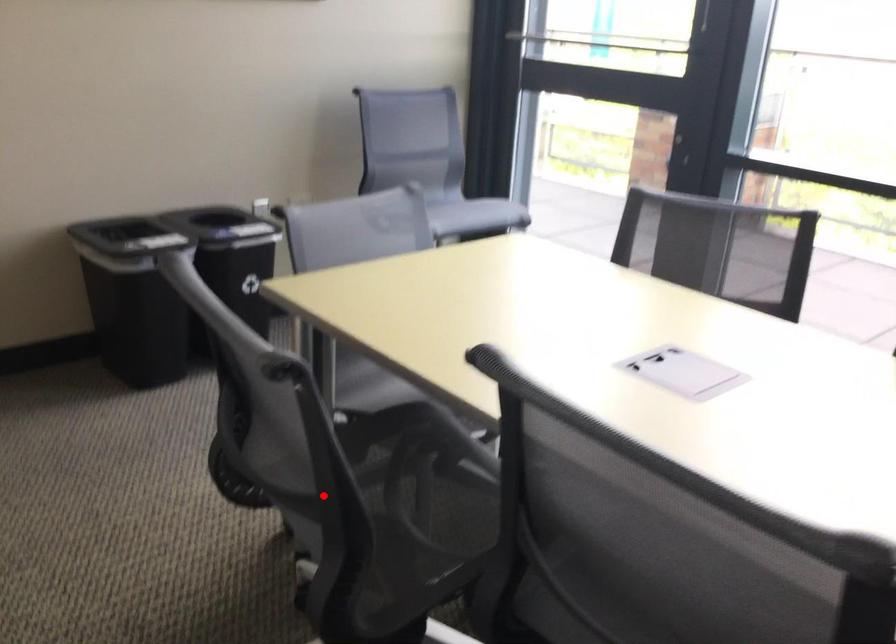
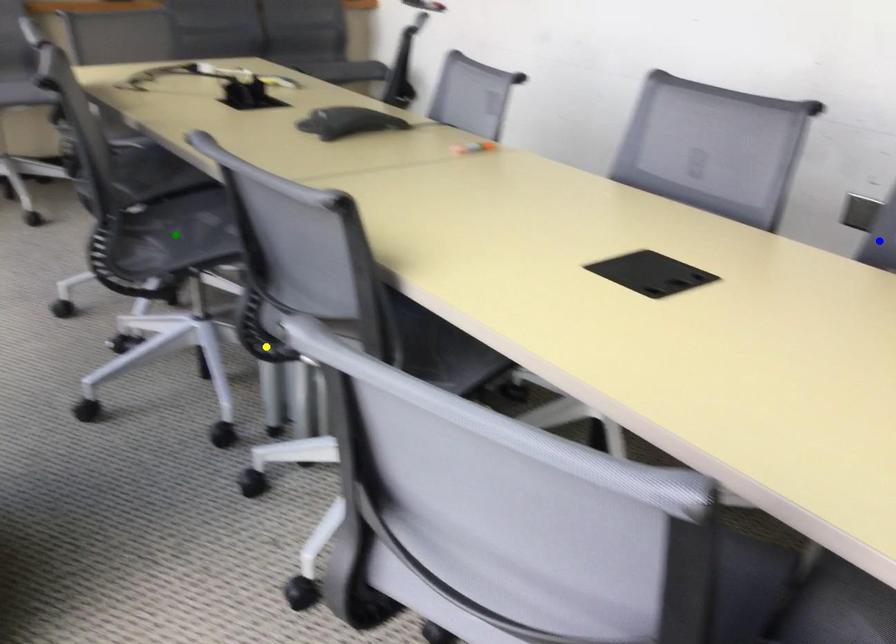
Question: I am providing you with two images of the same scene from different viewpoints. A red point is marked on the first image. You are given multiple points on the second image. Which spot in image 2 lines up with the point in image 1?

Choices:
 (A) blue point
 (B) yellow point
 (C) green point

Answer: (A)